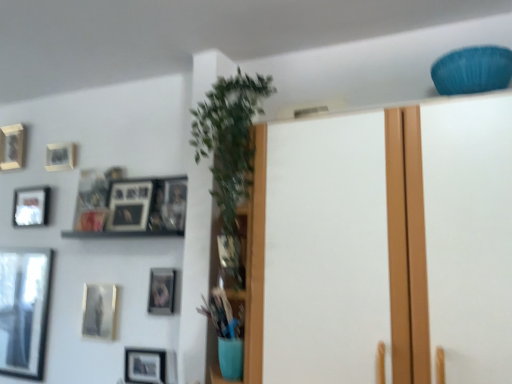
How much space does matte black picture frame at lower left, the 6th picture frame when ordered from left to right, occupy vertically?

8.77 inches.

You are a GUI agent. You are given a task and a screenshot of the screen. Output one action in this format:
    pyautogui.click(x=<x>, y=<y>)
    Task: Click on the matte gold picture frame at upper left, the fourth picture frame in the left-to-right sequence
    The width and height of the screenshot is (512, 384).
    Given the screenshot: What is the action you would take?
    pyautogui.click(x=60, y=156)

The width and height of the screenshot is (512, 384). I want to click on metallic silver picture frame at left, which ranks as the third picture frame in left-to-right order, so coord(24,310).

Measure the distance between point (12,145) and camera.

The distance of point (12,145) from camera is 6.62 feet.

The height and width of the screenshot is (384, 512). Find the location of `matte gold picture frame at upper left, acting as the first picture frame starting from the left`. matte gold picture frame at upper left, acting as the first picture frame starting from the left is located at coordinates (12, 146).

Locate an element on the screen. The image size is (512, 384). matte silver picture frame at upper left, which appears as the second picture frame when viewed from the left is located at coordinates (31, 206).

Does wooden framed picture at upper left contain metallic silver picture frame at left, which ranks as the third picture frame in left-to-right order?

Definitely not — metallic silver picture frame at left, which ranks as the third picture frame in left-to-right order, is not inside wooden framed picture at upper left.

From a real-world perspective, between wooden framed picture at upper left and metallic silver picture frame at left, which ranks as the third picture frame in left-to-right order, who is vertically lower?

From a 3D spatial view, metallic silver picture frame at left, which ranks as the third picture frame in left-to-right order, is below.

Which is behind, point (91, 235) or point (6, 290)?

The point (6, 290) is farther from the camera.

Is the surface of wooden framed picture at upper left in direct contact with metallic silver picture frame at left, the 6th picture frame from the right?

They are not placed beside each other.

Considering the sizes of objects matte gold picture frame at upper left, the fourth picture frame in the left-to-right sequence, and matte gold picture frame at upper left, acting as the first picture frame starting from the left, in the image provided, who is smaller, matte gold picture frame at upper left, the fourth picture frame in the left-to-right sequence, or matte gold picture frame at upper left, acting as the first picture frame starting from the left,?

With smaller size is matte gold picture frame at upper left, the fourth picture frame in the left-to-right sequence.

Choose the correct answer: Is matte gold picture frame at upper left, the fourth picture frame in the left-to-right sequence, inside matte gold picture frame at upper left, acting as the first picture frame starting from the left, or outside it?

matte gold picture frame at upper left, the fourth picture frame in the left-to-right sequence, lies outside matte gold picture frame at upper left, acting as the first picture frame starting from the left.

From the image's perspective, relative to matte gold picture frame at upper left, marked as the eighth picture frame in a right-to-left arrangement, is matte gold picture frame at upper left, the 5th picture frame positioned from the right, above or below?

From the image's perspective, matte gold picture frame at upper left, the 5th picture frame positioned from the right, appears below matte gold picture frame at upper left, marked as the eighth picture frame in a right-to-left arrangement.

How much distance is there between matte gold picture frame at upper left, the fourth picture frame in the left-to-right sequence, and matte gold picture frame at upper left, acting as the first picture frame starting from the left?

The distance of matte gold picture frame at upper left, the fourth picture frame in the left-to-right sequence, from matte gold picture frame at upper left, acting as the first picture frame starting from the left, is 8.66 inches.

Considering the points (117, 234) and (20, 209), which point is in front, point (117, 234) or point (20, 209)?

The point (117, 234) is closer to the camera.

Considering the relative sizes of wooden framed picture at upper left and matte silver picture frame at upper left, the seventh picture frame when ordered from right to left, in the image provided, is wooden framed picture at upper left bigger than matte silver picture frame at upper left, the seventh picture frame when ordered from right to left,?

Yes, wooden framed picture at upper left is bigger than matte silver picture frame at upper left, the seventh picture frame when ordered from right to left.

In order to click on shelf in front of the matte silver picture frame at upper left, which appears as the second picture frame when viewed from the left in this screenshot , I will do `click(121, 233)`.

Is wooden framed picture at upper left oriented away from matte silver picture frame at upper left, which appears as the second picture frame when viewed from the left?

No, wooden framed picture at upper left's orientation is not away from matte silver picture frame at upper left, which appears as the second picture frame when viewed from the left.

From the image's perspective, is green leafy plant at center located beneath metallic silver picture frame at upper left, which is the fifth picture frame from left to right?

No, from the image's perspective, green leafy plant at center is not beneath metallic silver picture frame at upper left, which is the fifth picture frame from left to right.

How much distance is there between green leafy plant at center and metallic silver picture frame at upper left, which is the fifth picture frame from left to right?

The distance of green leafy plant at center from metallic silver picture frame at upper left, which is the fifth picture frame from left to right, is 22.71 inches.

From the picture: Is green leafy plant at center turned away from metallic silver picture frame at upper left, which is the fifth picture frame from left to right?

green leafy plant at center is not turned away from metallic silver picture frame at upper left, which is the fifth picture frame from left to right.

Between green leafy plant at center and metallic silver picture frame at upper left, which is the fifth picture frame from left to right, which one has larger size?

Bigger between the two is green leafy plant at center.

Is matte gold picture frame at upper left, acting as the first picture frame starting from the left, positioned behind matte black picture frame at lower left, the 6th picture frame when ordered from left to right?

Yes, matte gold picture frame at upper left, acting as the first picture frame starting from the left, is further from the viewer.

Is matte gold picture frame at upper left, acting as the first picture frame starting from the left, with matte black picture frame at lower left, the 6th picture frame when ordered from left to right?

No.

Based on the photo, considering the relative positions of matte gold picture frame at upper left, acting as the first picture frame starting from the left, and matte black picture frame at lower left, the 6th picture frame when ordered from left to right, in the image provided, is matte gold picture frame at upper left, acting as the first picture frame starting from the left, to the left of matte black picture frame at lower left, the 6th picture frame when ordered from left to right, from the viewer's perspective?

Correct, you'll find matte gold picture frame at upper left, acting as the first picture frame starting from the left, to the left of matte black picture frame at lower left, the 6th picture frame when ordered from left to right.

Can you confirm if matte gold picture frame at upper left, acting as the first picture frame starting from the left, is thinner than matte black picture frame at lower left, positioned as the 3th picture frame in right-to-left order?

No, matte gold picture frame at upper left, acting as the first picture frame starting from the left, is not thinner than matte black picture frame at lower left, positioned as the 3th picture frame in right-to-left order.

Is matte silver picture frame at upper left, which appears as the second picture frame when viewed from the left, completely or partially outside of green leafy plant at center?

Yes, matte silver picture frame at upper left, which appears as the second picture frame when viewed from the left, is not within green leafy plant at center.

Consider the image. Is matte silver picture frame at upper left, which appears as the second picture frame when viewed from the left, looking in the opposite direction of green leafy plant at center?

matte silver picture frame at upper left, which appears as the second picture frame when viewed from the left, is not turned away from green leafy plant at center.

Considering the positions of objects matte silver picture frame at upper left, which appears as the second picture frame when viewed from the left, and green leafy plant at center in the image provided, who is more to the right, matte silver picture frame at upper left, which appears as the second picture frame when viewed from the left, or green leafy plant at center?

Positioned to the right is green leafy plant at center.

Measure the distance between wooden framed picture at upper left and matte gold picture frame at upper left, the 5th picture frame positioned from the right.

A distance of 15.45 inches exists between wooden framed picture at upper left and matte gold picture frame at upper left, the 5th picture frame positioned from the right.

What's the angular difference between wooden framed picture at upper left and matte gold picture frame at upper left, the 5th picture frame positioned from the right,'s facing directions?

The angular difference between wooden framed picture at upper left and matte gold picture frame at upper left, the 5th picture frame positioned from the right, is 2.15 degrees.

From the image's perspective, is wooden framed picture at upper left on top of matte gold picture frame at upper left, the 5th picture frame positioned from the right?

Actually, wooden framed picture at upper left appears below matte gold picture frame at upper left, the 5th picture frame positioned from the right, in the image.

Between point (116, 231) and point (70, 147), which one is positioned in front?

Positioned in front is point (116, 231).

This screenshot has width=512, height=384. I want to click on the 3rd picture frame below the wooden framed picture at upper left (from the image's perspective), so click(24, 310).

Starting from the matte gold picture frame at upper left, marked as the eighth picture frame in a right-to-left arrangement, which picture frame is the 3rd one to the right? Please provide its 2D coordinates.

[(60, 156)]

From the image, which object appears to be nearer to metallic silver picture frame at upper left, which is the fifth picture frame from left to right, matte black picture frame at lower left, positioned as the 3th picture frame in right-to-left order, or metallic silver picture frame at left, which ranks as the third picture frame in left-to-right order?

matte black picture frame at lower left, positioned as the 3th picture frame in right-to-left order, lies closer to metallic silver picture frame at upper left, which is the fifth picture frame from left to right, than the other object.

Which object lies nearer to the anchor point metallic silver picture frame at left, which ranks as the third picture frame in left-to-right order, matte silver picture frame at upper left, which appears as the second picture frame when viewed from the left, or matte gold picture frame at center-left, acting as the 8th picture frame starting from the left?

The object closer to metallic silver picture frame at left, which ranks as the third picture frame in left-to-right order, is matte silver picture frame at upper left, which appears as the second picture frame when viewed from the left.

Looking at the image, which one is located further to matte black picture frame at lower left, positioned as the 3th picture frame in right-to-left order, matte silver picture frame at upper left, the seventh picture frame when ordered from right to left, or matte black picture frame at lower center, marked as the seventh picture frame in a left-to-right arrangement?

The object further to matte black picture frame at lower left, positioned as the 3th picture frame in right-to-left order, is matte silver picture frame at upper left, the seventh picture frame when ordered from right to left.

When comparing their distances from wooden framed picture at upper left, does matte gold picture frame at upper left, acting as the first picture frame starting from the left, or metallic silver picture frame at left, which ranks as the third picture frame in left-to-right order, seem closer?

Based on the image, metallic silver picture frame at left, which ranks as the third picture frame in left-to-right order, appears to be nearer to wooden framed picture at upper left.

When comparing their distances from green leafy plant at center, does matte gold picture frame at upper left, acting as the first picture frame starting from the left, or matte gold picture frame at center-left, acting as the 8th picture frame starting from the left, seem further?

matte gold picture frame at upper left, acting as the first picture frame starting from the left, is further to green leafy plant at center.

From the image, which object appears to be nearer to matte black picture frame at lower center, marked as the 2th picture frame in a right-to-left arrangement, matte black picture frame at lower left, the 6th picture frame when ordered from left to right, or matte gold picture frame at center-left, arranged as the 1th picture frame when viewed from the right?

matte black picture frame at lower left, the 6th picture frame when ordered from left to right.

Which object lies nearer to the anchor point green leafy plant at center, matte gold picture frame at upper left, marked as the eighth picture frame in a right-to-left arrangement, or metallic silver picture frame at upper left, which is the fourth picture frame in right-to-left order?

metallic silver picture frame at upper left, which is the fourth picture frame in right-to-left order, lies closer to green leafy plant at center than the other object.

Estimate the real-world distances between objects in this image. Which object is further from matte gold picture frame at center-left, arranged as the 1th picture frame when viewed from the right, matte gold picture frame at upper left, acting as the first picture frame starting from the left, or matte gold picture frame at upper left, the fourth picture frame in the left-to-right sequence?

The object further to matte gold picture frame at center-left, arranged as the 1th picture frame when viewed from the right, is matte gold picture frame at upper left, acting as the first picture frame starting from the left.

I want to click on shelf situated between metallic silver picture frame at left, the 6th picture frame from the right, and matte gold picture frame at center-left, arranged as the 1th picture frame when viewed from the right, from left to right, so click(121, 233).

The width and height of the screenshot is (512, 384). Find the location of `picture frame that lies between wooden framed picture at upper left and matte black picture frame at lower left, the 6th picture frame when ordered from left to right, from top to bottom`. picture frame that lies between wooden framed picture at upper left and matte black picture frame at lower left, the 6th picture frame when ordered from left to right, from top to bottom is located at coordinates (161, 291).

Where is `shelf between matte silver picture frame at upper left, which appears as the second picture frame when viewed from the left, and matte gold picture frame at center-left, arranged as the 1th picture frame when viewed from the right`? This screenshot has width=512, height=384. shelf between matte silver picture frame at upper left, which appears as the second picture frame when viewed from the left, and matte gold picture frame at center-left, arranged as the 1th picture frame when viewed from the right is located at coordinates point(121,233).

You are a GUI agent. You are given a task and a screenshot of the screen. Output one action in this format:
    pyautogui.click(x=<x>, y=<y>)
    Task: Click on the plant between metallic silver picture frame at left, which ranks as the third picture frame in left-to-right order, and white matte door at center
    
    Given the screenshot: What is the action you would take?
    pyautogui.click(x=230, y=147)